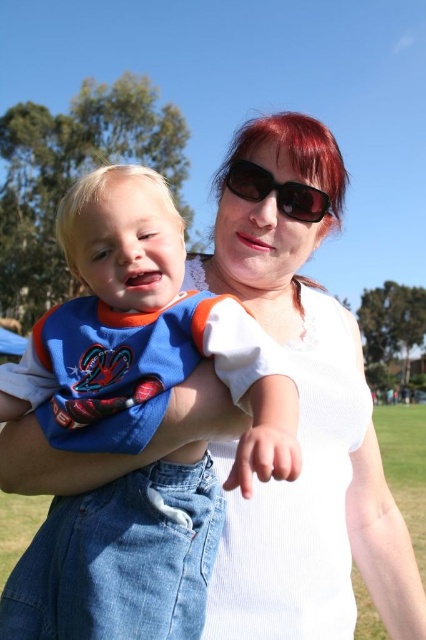
You are a photographer standing in front of the woman and child. You need to focus your camera on the matte blue jersey at center and the sunglasses at center. How far apart are these two items?

The matte blue jersey at center is 36.18 inches from the sunglasses at center, so the distance between them is 36.18 inches.

You are a photographer trying to capture the perfect shot of the matte blue jersey at center. You need to position your camera at the exact coordinates where the jersey is located. What are the coordinates you should aim for?

The coordinates for the matte blue jersey at center are at point (143, 336).